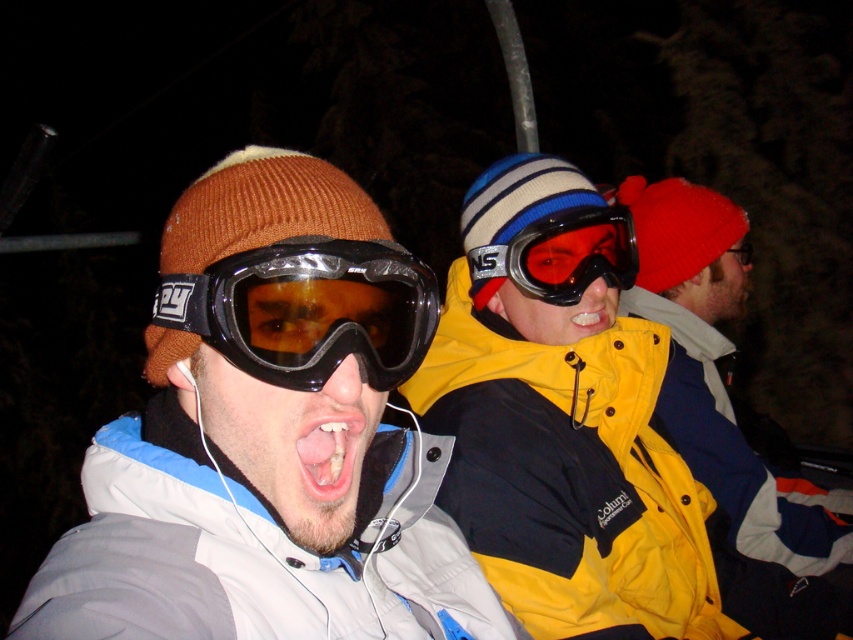
You are standing in the foreground of the scene and want to hand a map to the person wearing the matte yellow jacket at right. Based on their position, in which direction should you move to approach them?

The matte yellow jacket at right is located at point (718, 372), so you should move to the right and slightly upward to approach them.

You are a photographer trying to capture a clear shot of the matte gray jacket at center and the transparent plastic goggles at center in the dark scene. Which object should you focus on first to ensure it is in sharp focus?

The matte gray jacket at center is below transparent plastic goggles at center, so you should focus on the transparent plastic goggles at center first since it is closer to the camera.